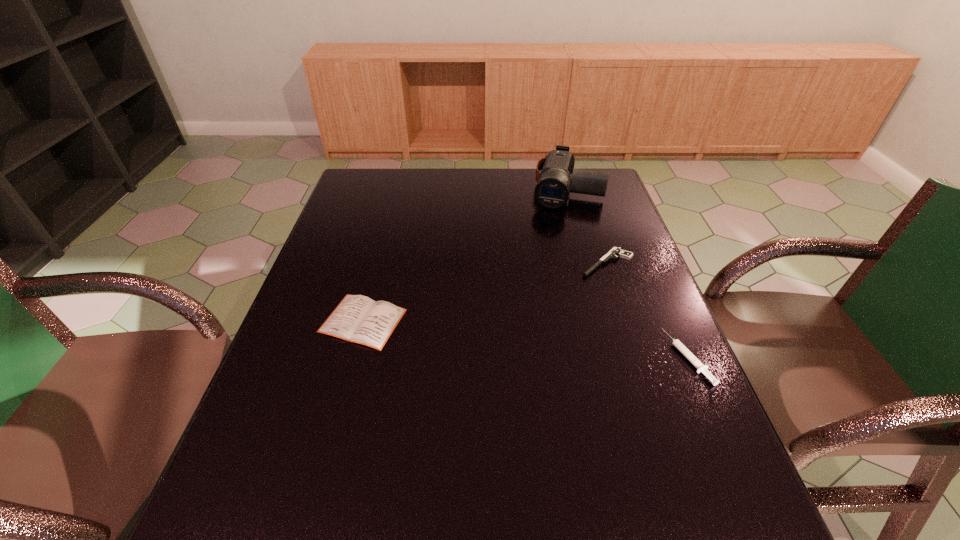
Locate an element on the screen. free space on the desktop that is between the diary and the syringe and is positioned on the lens of the tallest object is located at coordinates (523, 339).

Find the location of `free space on the desktop that is between the diary and the syringe and is positioned on the front-facing side of the pistol`. free space on the desktop that is between the diary and the syringe and is positioned on the front-facing side of the pistol is located at coordinates (521, 339).